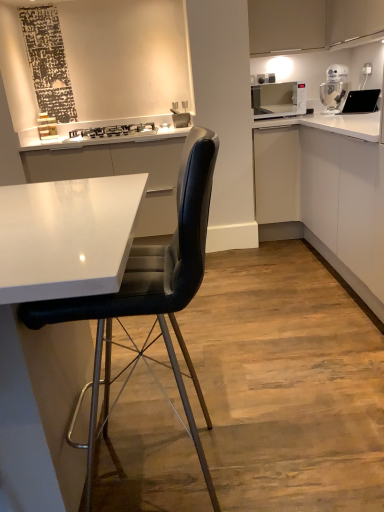
Question: Is white glossy stand mixer at upper right not within matte white cabinet at upper right, the third cabinetry when ordered from bottom to top?

Choices:
 (A) yes
 (B) no

Answer: (A)

Question: Is matte white cabinet at upper right, which is the first cabinetry in top-to-bottom order, at the back of white glossy stand mixer at upper right?

Choices:
 (A) no
 (B) yes

Answer: (A)

Question: Can you confirm if white glossy stand mixer at upper right is bigger than matte white cabinet at upper right, which is the first cabinetry in top-to-bottom order?

Choices:
 (A) no
 (B) yes

Answer: (A)

Question: Considering the relative sizes of white glossy stand mixer at upper right and matte white cabinet at upper right, the third cabinetry when ordered from bottom to top, in the image provided, is white glossy stand mixer at upper right smaller than matte white cabinet at upper right, the third cabinetry when ordered from bottom to top,?

Choices:
 (A) yes
 (B) no

Answer: (A)

Question: Are white glossy stand mixer at upper right and matte white cabinet at upper right, the third cabinetry when ordered from bottom to top, far apart?

Choices:
 (A) yes
 (B) no

Answer: (B)

Question: From a real-world perspective, is white glossy stand mixer at upper right on matte white cabinet at upper right, which is the first cabinetry in top-to-bottom order?

Choices:
 (A) no
 (B) yes

Answer: (A)

Question: From a real-world perspective, is black leather chair at center under white glossy microwave at upper right?

Choices:
 (A) yes
 (B) no

Answer: (A)

Question: From the image's perspective, would you say black leather chair at center is shown under white glossy microwave at upper right?

Choices:
 (A) no
 (B) yes

Answer: (B)

Question: Is black leather chair at center positioned far away from white glossy microwave at upper right?

Choices:
 (A) no
 (B) yes

Answer: (B)

Question: Is black leather chair at center positioned before white glossy microwave at upper right?

Choices:
 (A) yes
 (B) no

Answer: (A)

Question: Considering the relative positions of black leather chair at center and white glossy microwave at upper right in the image provided, is black leather chair at center behind white glossy microwave at upper right?

Choices:
 (A) yes
 (B) no

Answer: (B)

Question: Can you confirm if black leather chair at center is thinner than white glossy microwave at upper right?

Choices:
 (A) yes
 (B) no

Answer: (B)

Question: Is white glossy microwave at upper right shorter than white matte cabinet at center-right, which appears as the 2th cabinetry when viewed from the top?

Choices:
 (A) yes
 (B) no

Answer: (A)